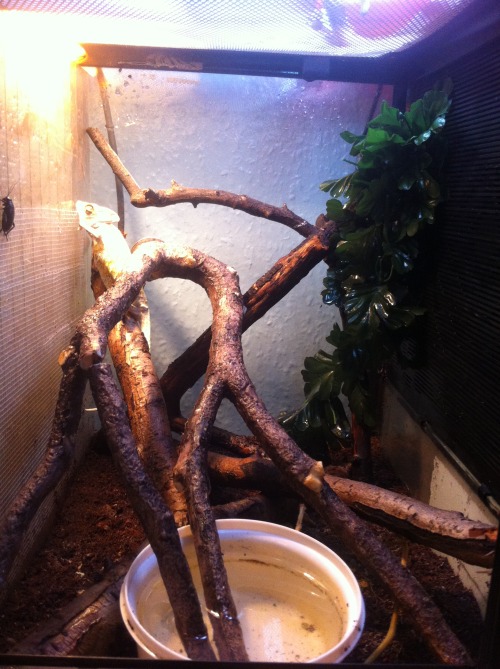
Identify the location of plant. (355, 255).